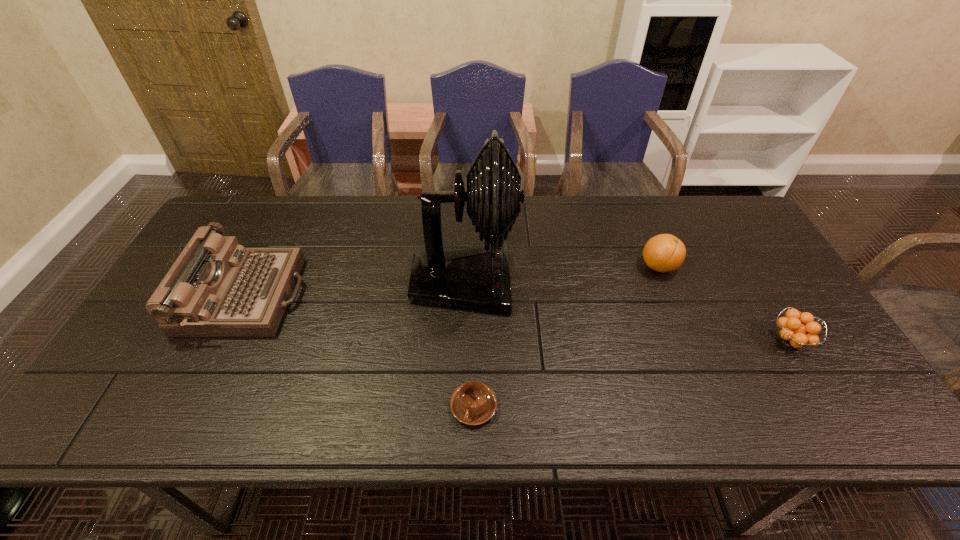
Where is `vacant space that's between the tallest object and the nearest object`? Image resolution: width=960 pixels, height=540 pixels. vacant space that's between the tallest object and the nearest object is located at coordinates click(x=469, y=345).

Choose which object is the second nearest neighbor to the second tallest object. Please provide its 2D coordinates. Your answer should be formatted as a tuple, i.e. [(x, y)], where the tuple contains the x and y coordinates of a point satisfying the conditions above.

[(473, 403)]

I want to click on object that ranks as the second closest to the fourth object from left to right, so pos(477,278).

Where is `vacant space that satisfies the following two spatial constraints: 1. in front of the fan to blow air; 2. on the back side of the right orange fruit`? The image size is (960, 540). vacant space that satisfies the following two spatial constraints: 1. in front of the fan to blow air; 2. on the back side of the right orange fruit is located at coordinates (463, 341).

I want to click on vacant space that satisfies the following two spatial constraints: 1. on the keyboard of the typewriter; 2. on the left side of the shorter orange fruit, so click(x=225, y=341).

Find the location of a particular element. The width and height of the screenshot is (960, 540). vacant region that satisfies the following two spatial constraints: 1. on the keyboard of the fourth shortest object; 2. on the left side of the fourth tallest object is located at coordinates (225, 341).